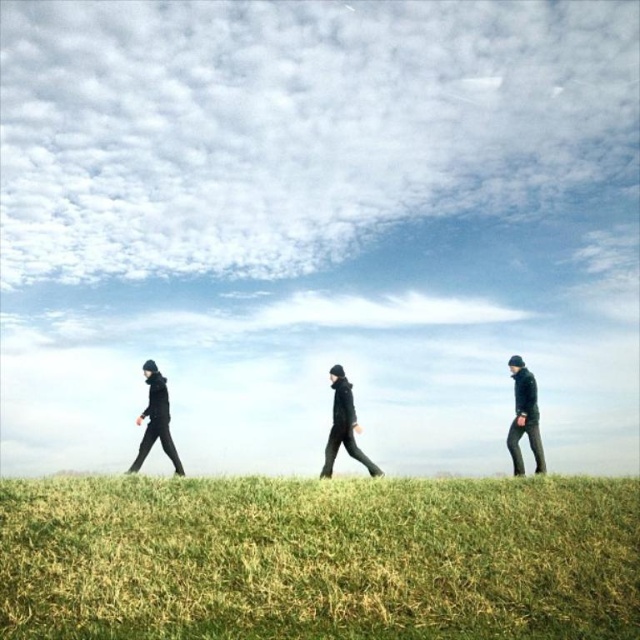
Question: Which is nearer to the dark green pants at right?

Choices:
 (A) black matte jacket at center
 (B) green grass at lower center

Answer: (A)

Question: Which object is closer to the camera taking this photo?

Choices:
 (A) black matte jacket at center
 (B) dark green pants at right
 (C) black matte jacket at left
 (D) green grass at lower center

Answer: (D)

Question: Is dark green pants at right positioned before black matte jacket at center?

Choices:
 (A) no
 (B) yes

Answer: (A)

Question: Observing the image, what is the correct spatial positioning of green grass at lower center in reference to dark green pants at right?

Choices:
 (A) left
 (B) right

Answer: (A)

Question: Among these objects, which one is nearest to the camera?

Choices:
 (A) black matte jacket at left
 (B) green grass at lower center
 (C) black matte jacket at center
 (D) dark green pants at right

Answer: (B)

Question: Can you confirm if black matte jacket at center is thinner than black matte jacket at left?

Choices:
 (A) yes
 (B) no

Answer: (B)